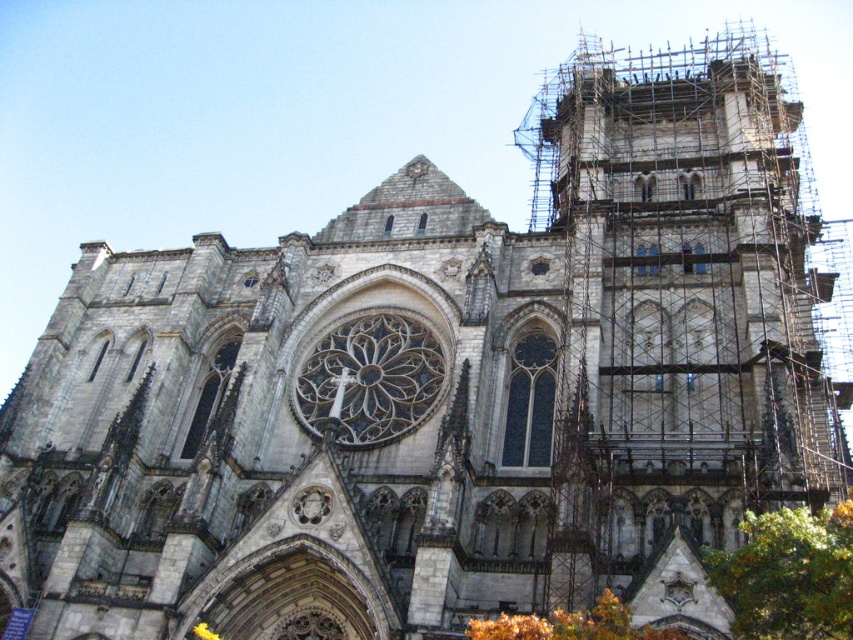
Is green leafy tree at lower right taller than orange leafy tree at lower right?

Correct, green leafy tree at lower right is much taller as orange leafy tree at lower right.

Based on the photo, is green leafy tree at lower right closer to camera compared to orange leafy tree at lower right?

Yes, it is.

Is point (830, 566) closer to viewer compared to point (599, 637)?

Yes, point (830, 566) is in front of point (599, 637).

Image resolution: width=853 pixels, height=640 pixels. In order to click on green leafy tree at lower right in this screenshot , I will do `click(788, 573)`.